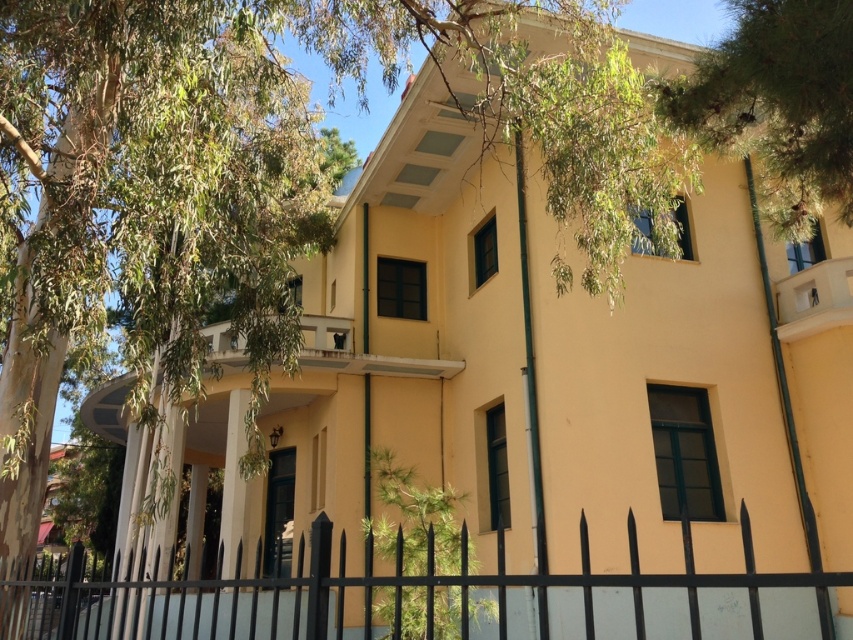
Based on the photo, is black metal fence at lower center closer to the viewer compared to green leafy tree at upper right?

That is True.

Identify the location of black metal fence at lower center. (421, 598).

In order to click on black metal fence at lower center in this screenshot , I will do `click(421, 598)`.

Where is `black metal fence at lower center`? Image resolution: width=853 pixels, height=640 pixels. black metal fence at lower center is located at coordinates (421, 598).

Is green leafy tree at upper left shorter than green leafy tree at upper right?

Indeed, green leafy tree at upper left has a lesser height compared to green leafy tree at upper right.

Is point (170, 218) closer to viewer compared to point (699, 116)?

Yes.

In order to click on green leafy tree at upper left in this screenshot , I will do `click(196, 179)`.

Can you confirm if green leafy tree at upper left is thinner than black metal fence at lower center?

Yes, green leafy tree at upper left is thinner than black metal fence at lower center.

Is green leafy tree at upper left smaller than black metal fence at lower center?

Correct, green leafy tree at upper left occupies less space than black metal fence at lower center.

Between point (102, 60) and point (91, 636), which one is positioned behind?

The point (91, 636) is behind.

In order to click on green leafy tree at upper left in this screenshot , I will do `click(196, 179)`.